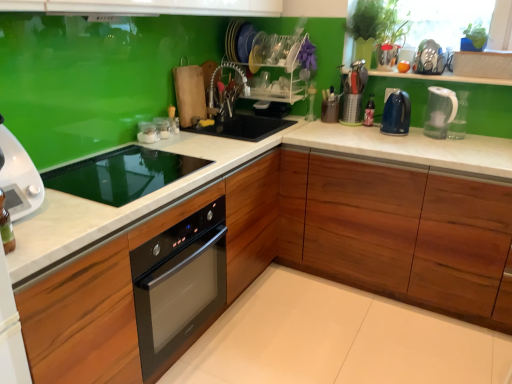
This screenshot has height=384, width=512. In order to click on free space to the left of transparent glass bottle at upper right, positioned as the first bottle in left-to-right order in this screenshot , I will do `click(287, 120)`.